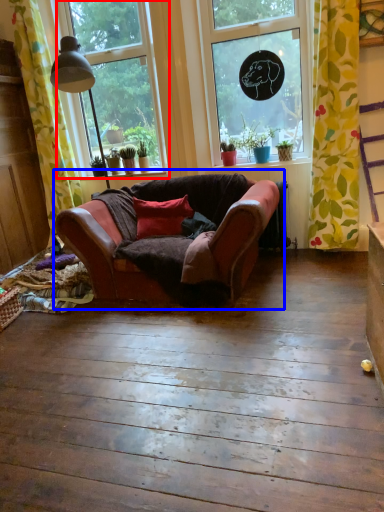
Question: Which object appears closest to the camera in this image, window (highlighted by a red box) or studio couch (highlighted by a blue box)?

Choices:
 (A) window
 (B) studio couch

Answer: (B)